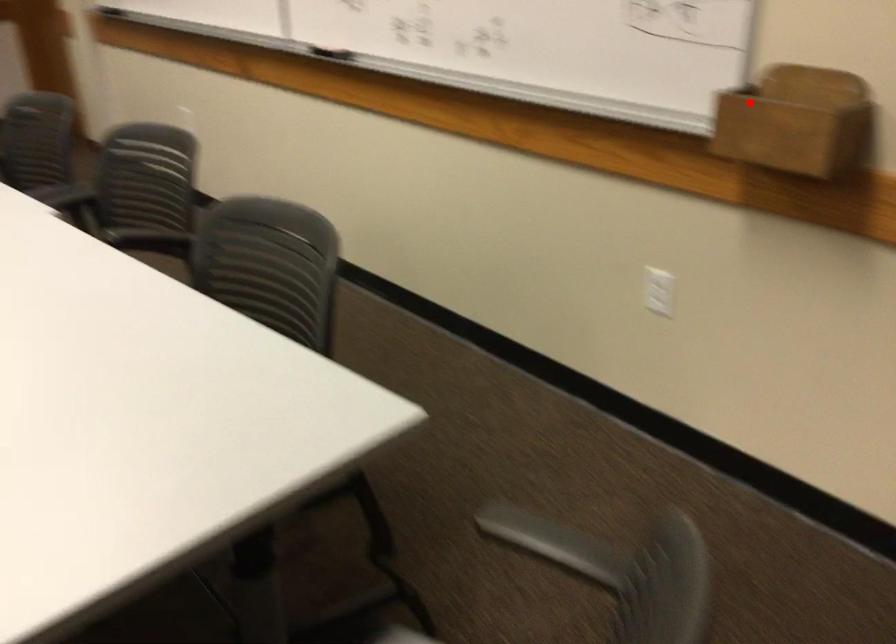
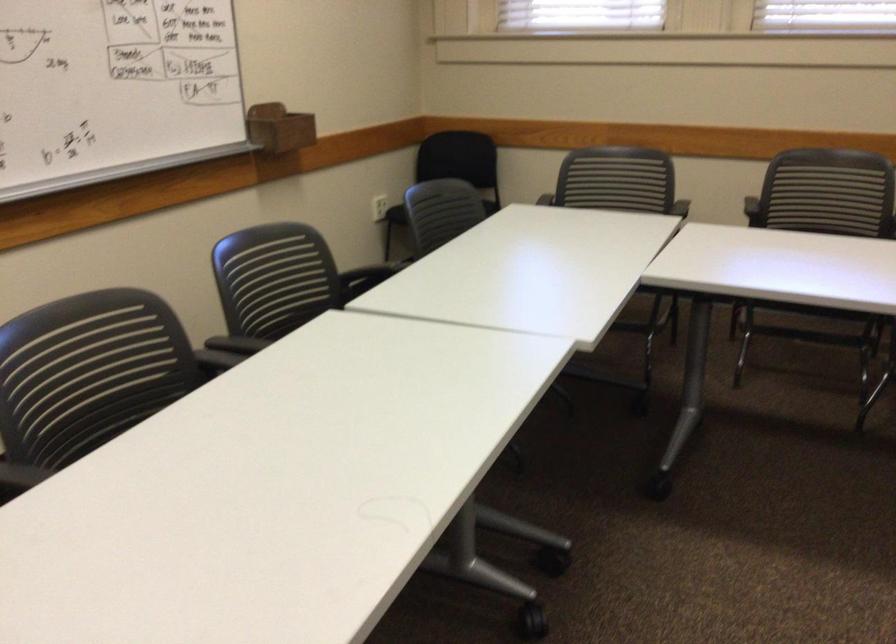
Question: I am providing you with two images of the same scene from different viewpoints. A red point is shown in image1. For the corresponding object point in image2, is it positioned nearer or farther from the camera?

Choices:
 (A) Nearer
 (B) Farther

Answer: (B)